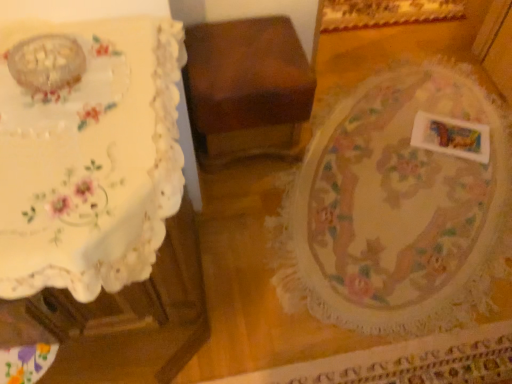
Question: Are white lace tablecloth at left and floral lace tablecloth at center making contact?

Choices:
 (A) yes
 (B) no

Answer: (B)

Question: From a real-world perspective, is white lace tablecloth at left located beneath floral lace tablecloth at center?

Choices:
 (A) no
 (B) yes

Answer: (A)

Question: Is white lace tablecloth at left shorter than floral lace tablecloth at center?

Choices:
 (A) yes
 (B) no

Answer: (B)

Question: Is white lace tablecloth at left far away from floral lace tablecloth at center?

Choices:
 (A) no
 (B) yes

Answer: (A)

Question: Is white lace tablecloth at left closer to the viewer compared to floral lace tablecloth at center?

Choices:
 (A) no
 (B) yes

Answer: (B)

Question: From the image's perspective, is white lace tablecloth at left located beneath floral lace tablecloth at center?

Choices:
 (A) yes
 (B) no

Answer: (A)

Question: Can you confirm if floral lace tablecloth at center is shorter than white matte rectangular object at lower right?

Choices:
 (A) yes
 (B) no

Answer: (A)

Question: Is floral lace tablecloth at center surrounding white matte rectangular object at lower right?

Choices:
 (A) yes
 (B) no

Answer: (A)

Question: Are floral lace tablecloth at center and white matte rectangular object at lower right located far from each other?

Choices:
 (A) no
 (B) yes

Answer: (A)

Question: Is floral lace tablecloth at center placed right next to white matte rectangular object at lower right?

Choices:
 (A) no
 (B) yes

Answer: (A)

Question: Does floral lace tablecloth at center have a larger size compared to white matte rectangular object at lower right?

Choices:
 (A) yes
 (B) no

Answer: (A)

Question: From the image's perspective, is floral lace tablecloth at center beneath white matte rectangular object at lower right?

Choices:
 (A) yes
 (B) no

Answer: (A)

Question: From a real-world perspective, is floral lace tablecloth at center beneath white lace tablecloth at left?

Choices:
 (A) no
 (B) yes

Answer: (B)